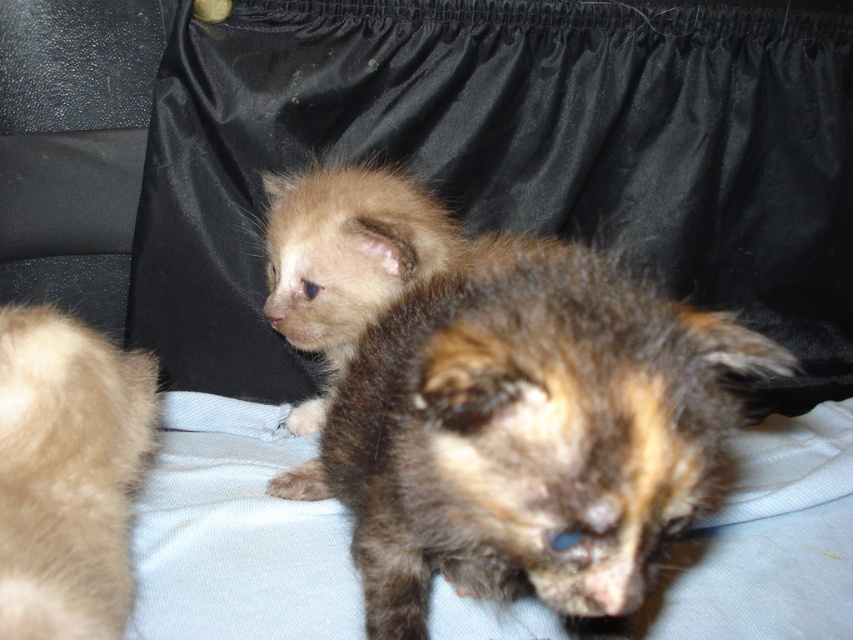
Question: Can you confirm if brown fuzzy kitten at center is smaller than light brown fur at left?

Choices:
 (A) no
 (B) yes

Answer: (A)

Question: Is brown fuzzy kitten at center to the left of light brown fur at left from the viewer's perspective?

Choices:
 (A) no
 (B) yes

Answer: (A)

Question: Among these points, which one is nearest to the camera?

Choices:
 (A) (688, 499)
 (B) (119, 513)

Answer: (A)

Question: Observing the image, what is the correct spatial positioning of brown fuzzy kitten at center in reference to light brown fur at left?

Choices:
 (A) left
 (B) right

Answer: (B)